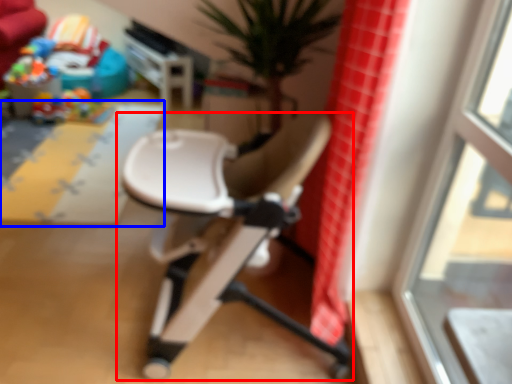
Question: Among these objects, which one is nearest to the camera, chair (highlighted by a red box) or plain (highlighted by a blue box)?

Choices:
 (A) chair
 (B) plain

Answer: (A)